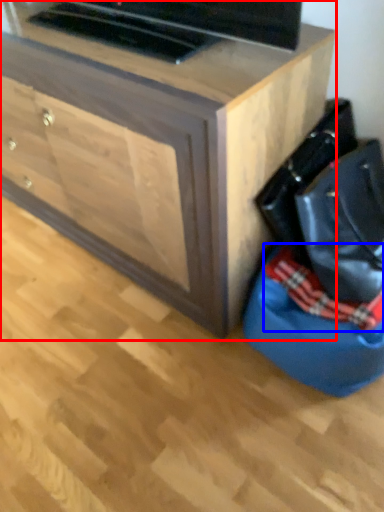
Question: Among these objects, which one is farthest to the camera, chest of drawers (highlighted by a red box) or blanket (highlighted by a blue box)?

Choices:
 (A) chest of drawers
 (B) blanket

Answer: (B)